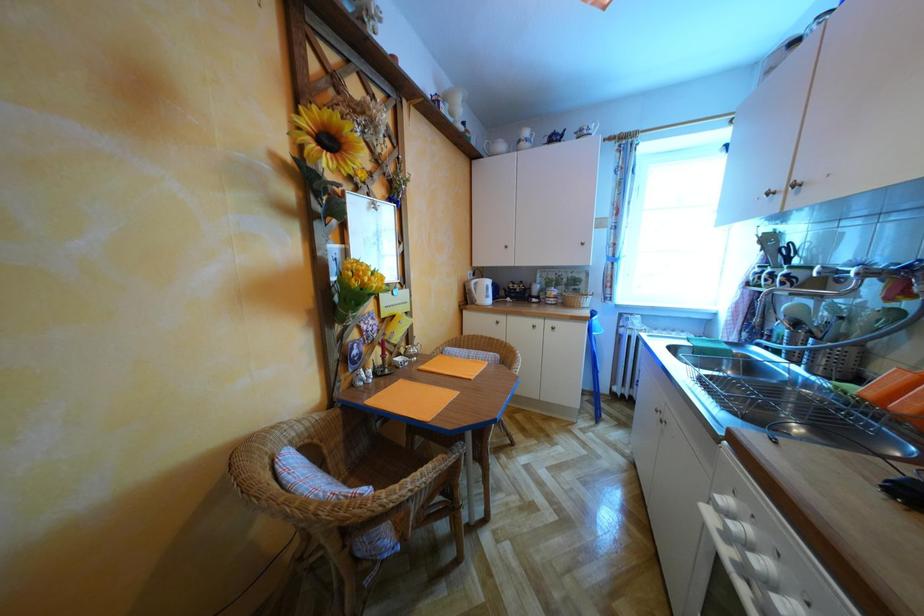
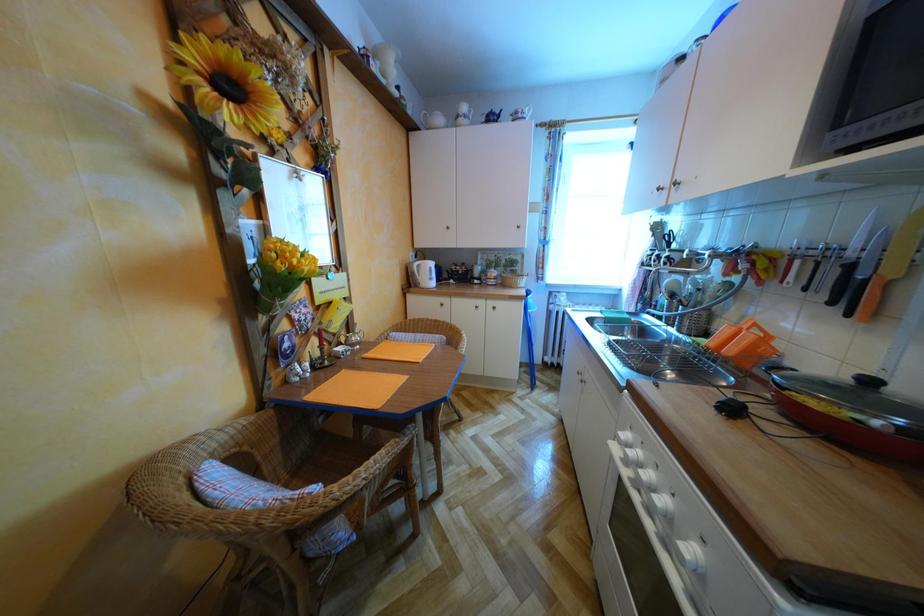
Question: The camera is either moving clockwise (left) or counter-clockwise (right) around the object. The first image is from the beginning of the video and the second image is from the end. Is the camera moving left or right when shooting the video?

Choices:
 (A) Left
 (B) Right

Answer: (A)